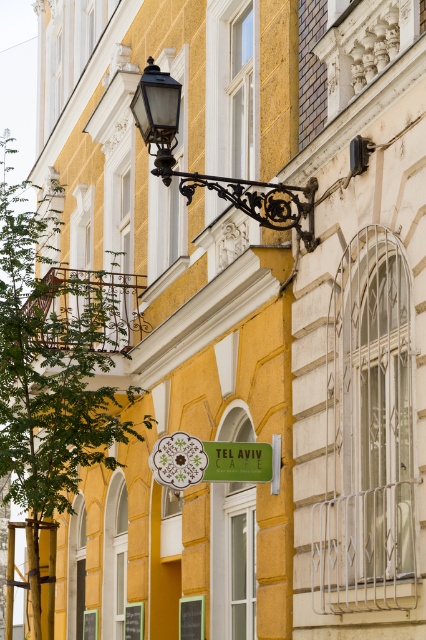
Which is more to the left, matte black lamp at upper left or green matte signboard at center?

From the viewer's perspective, green matte signboard at center appears more on the left side.

Based on the photo, who is shorter, matte black lamp at upper left or green matte signboard at center?

With less height is green matte signboard at center.

In order to click on matte black lamp at upper left in this screenshot , I will do `click(215, 176)`.